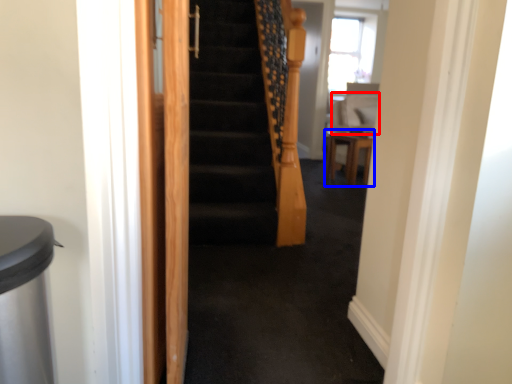
Question: Which object appears farthest to the camera in this image, sit (highlighted by a red box) or furniture (highlighted by a blue box)?

Choices:
 (A) sit
 (B) furniture

Answer: (A)